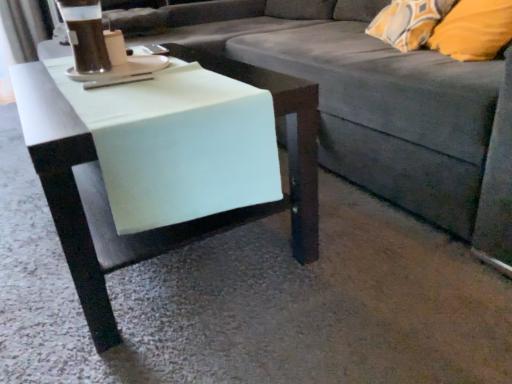
What do you see at coordinates (124, 69) in the screenshot?
I see `white glossy saucer at upper left` at bounding box center [124, 69].

You are a GUI agent. You are given a task and a screenshot of the screen. Output one action in this format:
    pyautogui.click(x=<x>, y=<y>)
    Task: Click on the white glossy saucer at upper left
    The image size is (512, 384).
    Given the screenshot: What is the action you would take?
    pyautogui.click(x=124, y=69)

Where is `white glossy saucer at upper left`? The width and height of the screenshot is (512, 384). white glossy saucer at upper left is located at coordinates (124, 69).

From their relative heights in the image, would you say dark brown liquid at upper left is taller or shorter than white glossy saucer at upper left?

In the image, dark brown liquid at upper left appears to be taller than white glossy saucer at upper left.

How many degrees apart are the facing directions of dark brown liquid at upper left and white glossy saucer at upper left?

0.00131 degrees.

Which object is wider, dark brown liquid at upper left or white glossy saucer at upper left?

white glossy saucer at upper left is wider.

Between dark brown liquid at upper left and white glossy saucer at upper left, which one appears on the left side from the viewer's perspective?

dark brown liquid at upper left is more to the left.

What's the angular difference between gray fabric couch at center and dark brown liquid at upper left's facing directions?

2.36 degrees.

From the image's perspective, does gray fabric couch at center appear lower than dark brown liquid at upper left?

Indeed, from the image's perspective, gray fabric couch at center is shown beneath dark brown liquid at upper left.

Considering the sizes of objects gray fabric couch at center and dark brown liquid at upper left in the image provided, who is shorter, gray fabric couch at center or dark brown liquid at upper left?

dark brown liquid at upper left.

Is gray fabric couch at center closer to the viewer compared to dark brown liquid at upper left?

Yes, it is in front of dark brown liquid at upper left.

Does white glossy saucer at upper left have a lesser height compared to dark brown liquid at upper left?

Yes, white glossy saucer at upper left is shorter than dark brown liquid at upper left.

Which point is more forward, (106, 76) or (82, 69)?

Point (106, 76)

Between white glossy saucer at upper left and dark brown liquid at upper left, which one appears on the left side from the viewer's perspective?

dark brown liquid at upper left.

Could you tell me if white glossy saucer at upper left is facing dark brown liquid at upper left?

Yes, white glossy saucer at upper left is facing dark brown liquid at upper left.

Does dark brown liquid at upper left turn towards gray fabric couch at center?

Yes, dark brown liquid at upper left is turned towards gray fabric couch at center.

Is dark brown liquid at upper left at the right side of gray fabric couch at center?

In fact, dark brown liquid at upper left is to the left of gray fabric couch at center.

Is dark brown liquid at upper left wider or thinner than gray fabric couch at center?

In the image, dark brown liquid at upper left appears to be more narrow than gray fabric couch at center.

Looking at this image, which object is wider, gray fabric couch at center or white glossy saucer at upper left?

gray fabric couch at center is wider.

Does gray fabric couch at center have a smaller size compared to white glossy saucer at upper left?

No, gray fabric couch at center is not smaller than white glossy saucer at upper left.

Locate an element on the screen. studio couch lying above the white glossy saucer at upper left (from the image's perspective) is located at coordinates (373, 104).

Would you say white glossy saucer at upper left is part of gray fabric couch at center's contents?

That's correct, white glossy saucer at upper left is inside gray fabric couch at center.

Is white glossy saucer at upper left not within white matte table at center?

Absolutely, white glossy saucer at upper left is external to white matte table at center.

From a real-world perspective, which is physically above, white glossy saucer at upper left or white matte table at center?

From a 3D spatial view, white glossy saucer at upper left is above.

Is white glossy saucer at upper left at the right side of white matte table at center?

No, white glossy saucer at upper left is not to the right of white matte table at center.

Does white glossy saucer at upper left have a lesser width compared to white matte table at center?

Yes, white glossy saucer at upper left is thinner than white matte table at center.

Could you tell me if gray fabric couch at center is turned towards white matte table at center?

Yes, gray fabric couch at center is aimed at white matte table at center.

Consider the image. Considering the relative positions of gray fabric couch at center and white matte table at center in the image provided, is gray fabric couch at center to the left of white matte table at center from the viewer's perspective?

No, gray fabric couch at center is not to the left of white matte table at center.

Does point (503, 230) appear closer or farther from the camera than point (89, 151)?

Point (503, 230) is positioned farther from the camera compared to point (89, 151).

Based on the photo, from a real-world perspective, does gray fabric couch at center sit lower than white matte table at center?

Incorrect, from a real-world perspective, gray fabric couch at center is higher than white matte table at center.

This screenshot has width=512, height=384. Identify the location of saucer below the dark brown liquid at upper left (from a real-world perspective). (124, 69).

In order to click on beverage above the gray fabric couch at center (from a real-world perspective) in this screenshot , I will do `click(85, 35)`.

Which object lies further to the anchor point gray fabric couch at center, white glossy saucer at upper left or dark brown liquid at upper left?

Among the two, dark brown liquid at upper left is located further to gray fabric couch at center.

From the picture: From the image, which object appears to be nearer to dark brown liquid at upper left, white glossy saucer at upper left or white matte table at center?

white glossy saucer at upper left lies closer to dark brown liquid at upper left than the other object.

Which object lies further to the anchor point dark brown liquid at upper left, gray fabric couch at center or white glossy saucer at upper left?

gray fabric couch at center lies further to dark brown liquid at upper left than the other object.

From the image, which object appears to be nearer to white glossy saucer at upper left, dark brown liquid at upper left or white matte table at center?

dark brown liquid at upper left is closer to white glossy saucer at upper left.

Looking at the image, which one is located further to white glossy saucer at upper left, gray fabric couch at center or white matte table at center?

gray fabric couch at center lies further to white glossy saucer at upper left than the other object.

Looking at the image, which one is located closer to gray fabric couch at center, white matte table at center or white glossy saucer at upper left?

white matte table at center.

When comparing their distances from gray fabric couch at center, does dark brown liquid at upper left or white matte table at center seem closer?

white matte table at center.

Based on their spatial positions, is dark brown liquid at upper left or white glossy saucer at upper left further from white matte table at center?

dark brown liquid at upper left is positioned further to the anchor white matte table at center.

Image resolution: width=512 pixels, height=384 pixels. I want to click on saucer between dark brown liquid at upper left and gray fabric couch at center from left to right, so point(124,69).

This screenshot has width=512, height=384. Identify the location of beverage positioned between white matte table at center and white glossy saucer at upper left from near to far. (85, 35).

Locate an element on the screen. The height and width of the screenshot is (384, 512). table situated between dark brown liquid at upper left and gray fabric couch at center from left to right is located at coordinates (180, 223).

Locate an element on the screen. The image size is (512, 384). table between white glossy saucer at upper left and gray fabric couch at center in the horizontal direction is located at coordinates (180, 223).